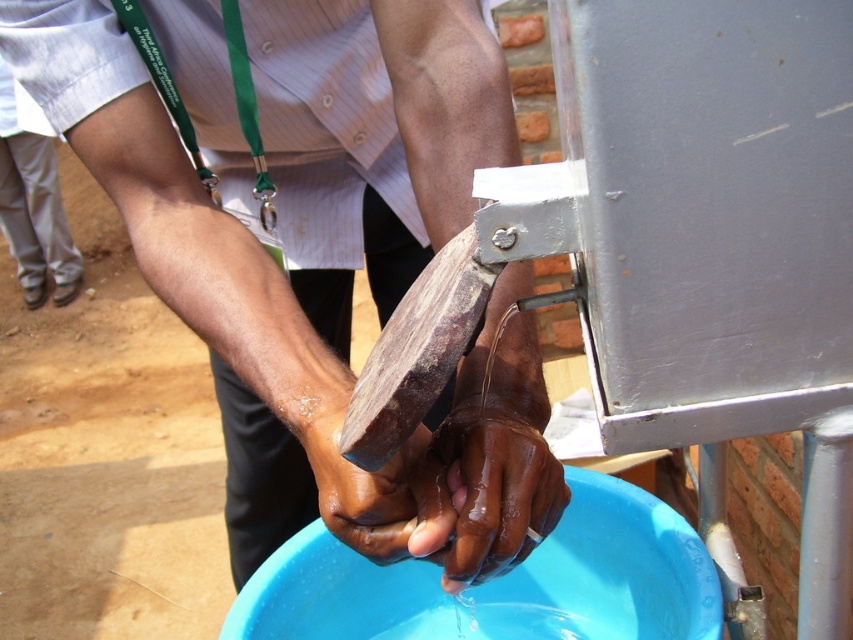
Does brown wooden block at center come in front of brown matte wooden block at center?

Yes, brown wooden block at center is in front of brown matte wooden block at center.

I want to click on brown wooden block at center, so click(323, 260).

Locate an element on the screen. The height and width of the screenshot is (640, 853). brown wooden block at center is located at coordinates (323, 260).

Does point (537, 444) come in front of point (402, 525)?

No.

Does brown matte hand at lower center have a smaller size compared to brown matte wooden block at center?

Yes, brown matte hand at lower center is smaller than brown matte wooden block at center.

Locate an element on the screen. This screenshot has width=853, height=640. brown matte hand at lower center is located at coordinates (483, 493).

Does brown wooden block at center appear on the right side of brown matte hand at lower center?

Incorrect, brown wooden block at center is not on the right side of brown matte hand at lower center.

What do you see at coordinates (323, 260) in the screenshot? Image resolution: width=853 pixels, height=640 pixels. I see `brown wooden block at center` at bounding box center [323, 260].

You are a GUI agent. You are given a task and a screenshot of the screen. Output one action in this format:
    pyautogui.click(x=<x>, y=<y>)
    Task: Click on the brown wooden block at center
    
    Given the screenshot: What is the action you would take?
    pyautogui.click(x=323, y=260)

This screenshot has width=853, height=640. I want to click on brown wooden block at center, so click(x=323, y=260).